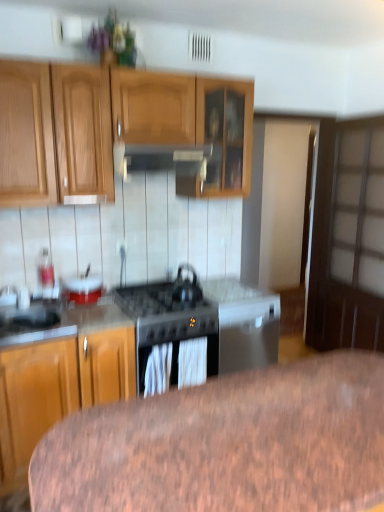
Question: Is satin silver exhaust hood at upper center to the right of white glossy bowl at center-left from the viewer's perspective?

Choices:
 (A) yes
 (B) no

Answer: (A)

Question: Is satin silver exhaust hood at upper center aimed at white glossy bowl at center-left?

Choices:
 (A) yes
 (B) no

Answer: (B)

Question: Can you confirm if satin silver exhaust hood at upper center is shorter than white glossy bowl at center-left?

Choices:
 (A) yes
 (B) no

Answer: (B)

Question: Considering the relative sizes of satin silver exhaust hood at upper center and white glossy bowl at center-left in the image provided, is satin silver exhaust hood at upper center taller than white glossy bowl at center-left?

Choices:
 (A) no
 (B) yes

Answer: (B)

Question: From the image's perspective, is satin silver exhaust hood at upper center below white glossy bowl at center-left?

Choices:
 (A) no
 (B) yes

Answer: (A)

Question: Looking at their shapes, would you say black matte gas stove at center is wider or thinner than satin silver sink at lower left?

Choices:
 (A) thin
 (B) wide

Answer: (B)

Question: In terms of height, does black matte gas stove at center look taller or shorter compared to satin silver sink at lower left?

Choices:
 (A) tall
 (B) short

Answer: (A)

Question: Visually, is black matte gas stove at center positioned to the left or to the right of satin silver sink at lower left?

Choices:
 (A) left
 (B) right

Answer: (B)

Question: Which is correct: black matte gas stove at center is inside satin silver sink at lower left, or outside of it?

Choices:
 (A) outside
 (B) inside

Answer: (A)

Question: Is black matte kettle at center in front of or behind black matte gas stove at center in the image?

Choices:
 (A) front
 (B) behind

Answer: (B)

Question: Considering the relative positions of black matte kettle at center and black matte gas stove at center in the image provided, is black matte kettle at center to the left or to the right of black matte gas stove at center?

Choices:
 (A) right
 (B) left

Answer: (A)

Question: Based on their sizes in the image, would you say black matte kettle at center is bigger or smaller than black matte gas stove at center?

Choices:
 (A) small
 (B) big

Answer: (A)

Question: Looking at their shapes, would you say black matte kettle at center is wider or thinner than black matte gas stove at center?

Choices:
 (A) wide
 (B) thin

Answer: (B)

Question: From their relative heights in the image, would you say white glossy bowl at center-left is taller or shorter than black matte gas stove at center?

Choices:
 (A) tall
 (B) short

Answer: (B)

Question: In terms of size, does white glossy bowl at center-left appear bigger or smaller than black matte gas stove at center?

Choices:
 (A) big
 (B) small

Answer: (B)